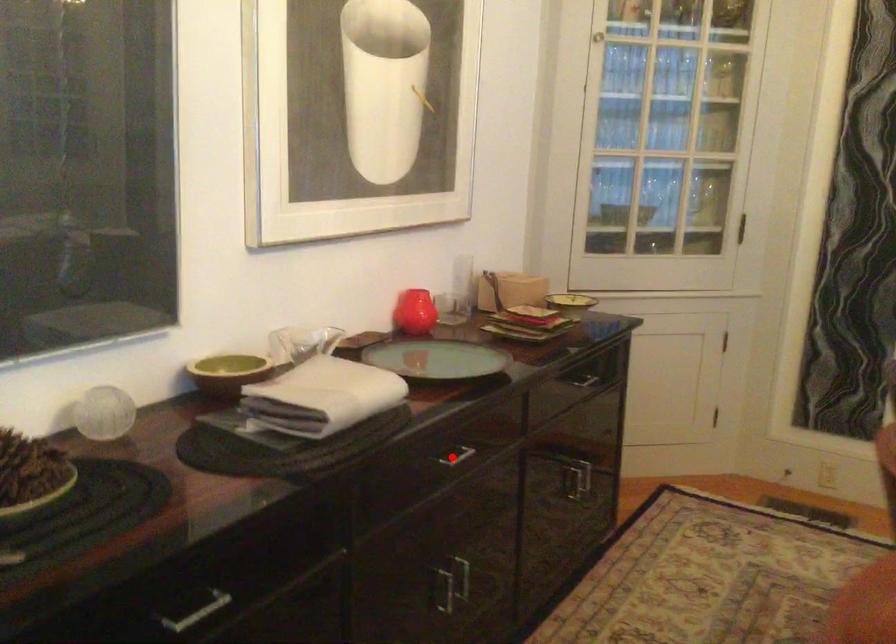
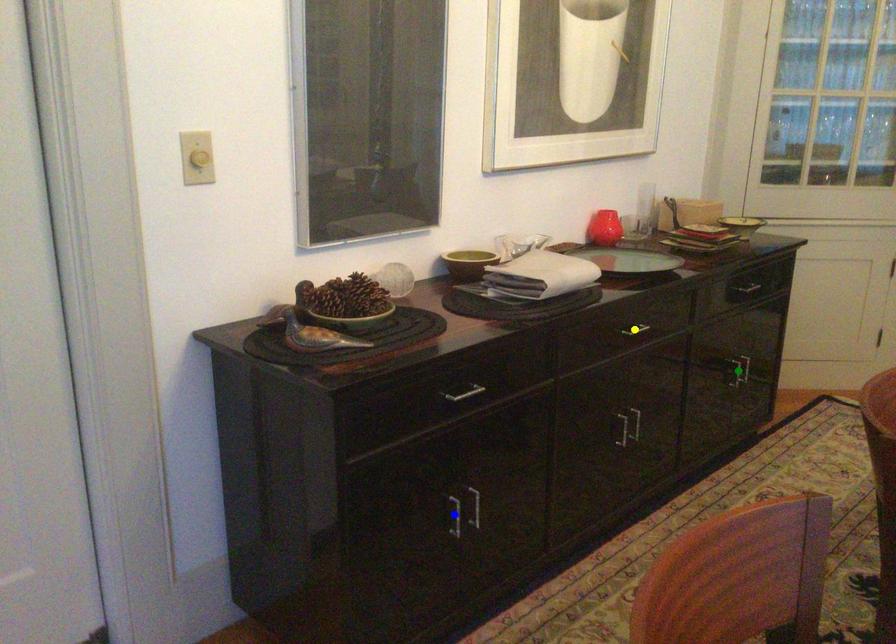
Question: I am providing you with two images of the same scene from different viewpoints. A red point is marked on the first image. You are given multiple points on the second image. Can you choose the point in image 2 that corresponds to the point in image 1?

Choices:
 (A) yellow point
 (B) blue point
 (C) green point

Answer: (A)